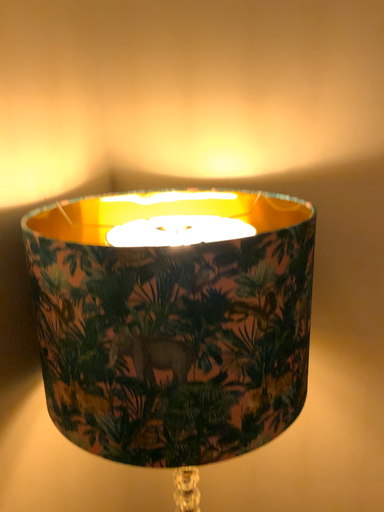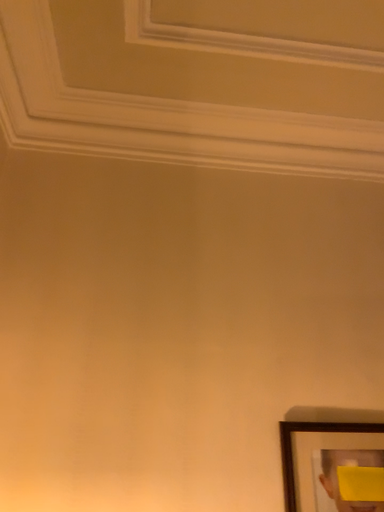
Question: How did the camera likely rotate when shooting the video?

Choices:
 (A) rotated downward
 (B) rotated upward

Answer: (B)